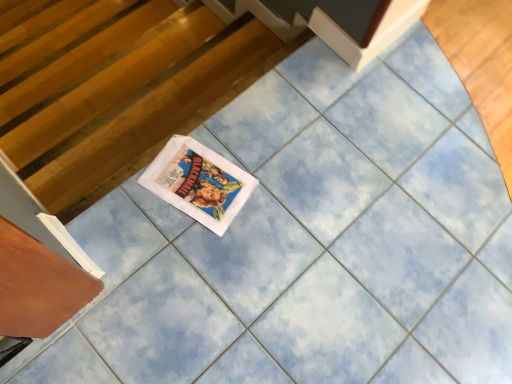
This screenshot has height=384, width=512. What are the coordinates of `vacant area situated below white paper comic book at center (from a real-world perspective)` in the screenshot? It's located at (197, 185).